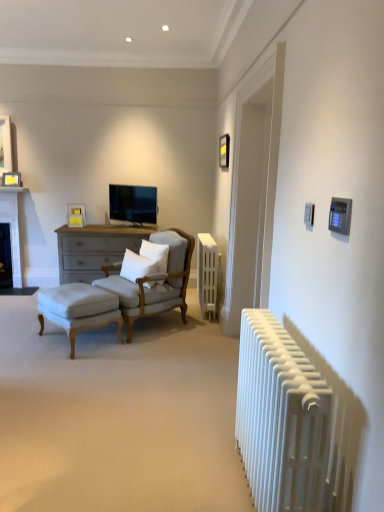
Question: Relative to white soft pillow at center, acting as the second pillow starting from the left, is white stone fireplace at left, the first fireplace from the top, in front or behind?

Choices:
 (A) front
 (B) behind

Answer: (B)

Question: From a real-world perspective, is white stone fireplace at left, the first fireplace from the top, positioned above or below white soft pillow at center, the first pillow in the right-to-left sequence?

Choices:
 (A) below
 (B) above

Answer: (A)

Question: Which object is the closest to the white metallic radiator at right, which is counted as the 2th radiator, starting from the back?

Choices:
 (A) matte black picture frame at upper center, the third picture frame when ordered from bottom to top
 (B) matte yellow picture frame at upper left, the 3th picture frame when ordered from front to back
 (C) dark gray stone fireplace at left, placed as the 1th fireplace when sorted from bottom to top
 (D) white soft cushion at center, the second pillow positioned from the right
 (E) white fabric ottoman at lower left

Answer: (E)

Question: Based on their relative distances, which object is farther from the white metallic radiator at center, which is counted as the 2th radiator, starting from the front?

Choices:
 (A) dark gray stone fireplace at left, placed as the 1th fireplace when sorted from bottom to top
 (B) matte black picture frame at upper center, marked as the 1th picture frame in a front-to-back arrangement
 (C) light beige fabric armchair at center-left
 (D) white soft pillow at center, acting as the second pillow starting from the left
 (E) white soft cushion at center, which is the first pillow in left-to-right order

Answer: (A)